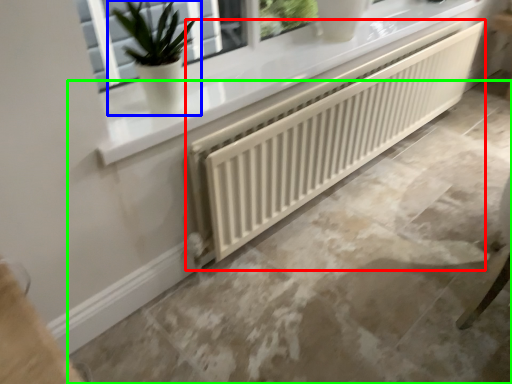
Question: Considering the real-world distances, which object is farthest from radiator (highlighted by a red box)? houseplant (highlighted by a blue box) or concrete (highlighted by a green box)?

Choices:
 (A) houseplant
 (B) concrete

Answer: (A)